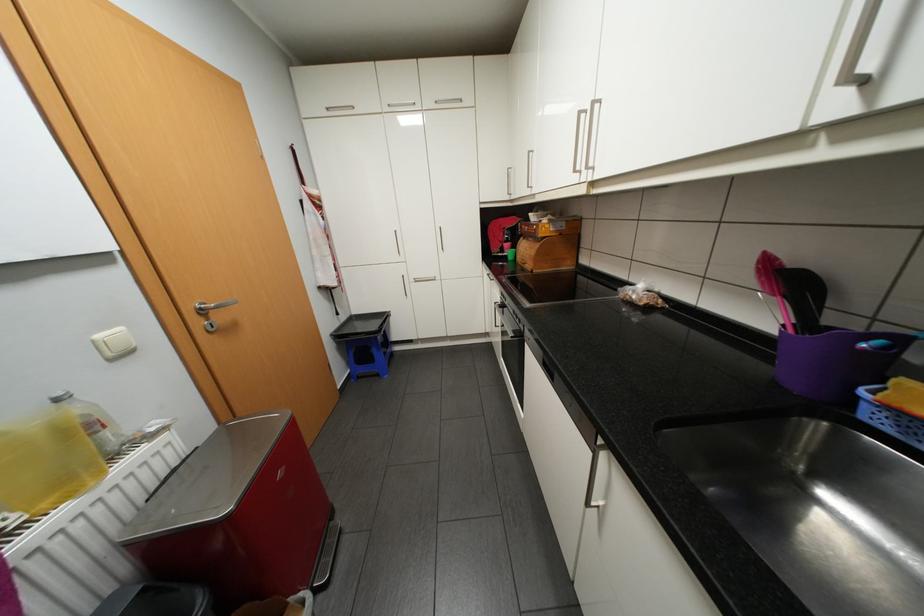
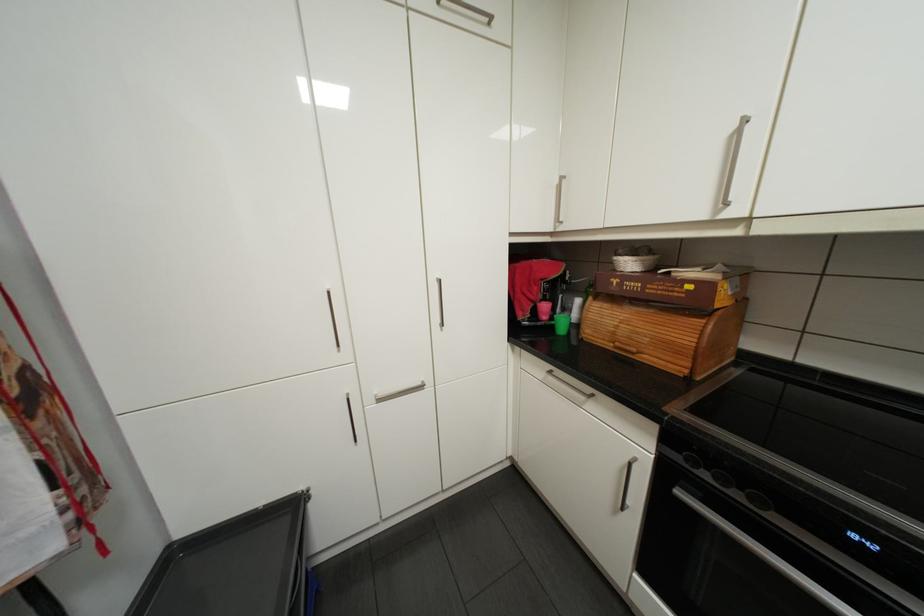
Consider the image. In a continuous first-person perspective shot, in which direction is the camera moving?

The movement direction of the cameraman is left, forward.